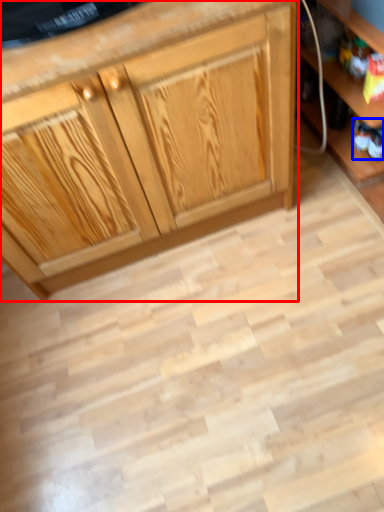
Question: Which point is further to the camera, cabinetry (highlighted by a red box) or toy (highlighted by a blue box)?

Choices:
 (A) cabinetry
 (B) toy

Answer: (B)